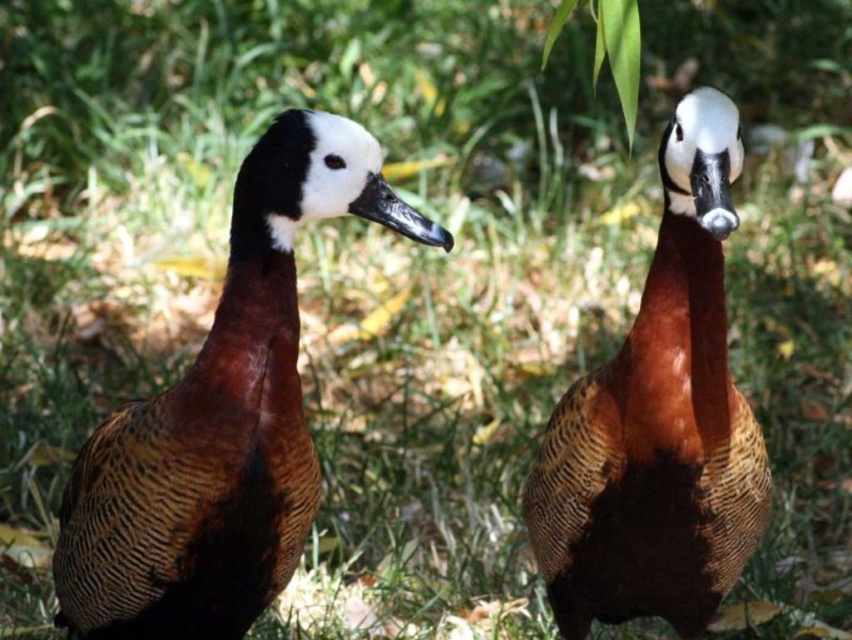
You are a birdwatcher observing two ducks on a grassy area. You notice the brown textured duck at left and the brown textured duck at center. Which duck is standing in front of the other?

The brown textured duck at left is positioned over brown textured duck at center, so it is standing in front of the other.